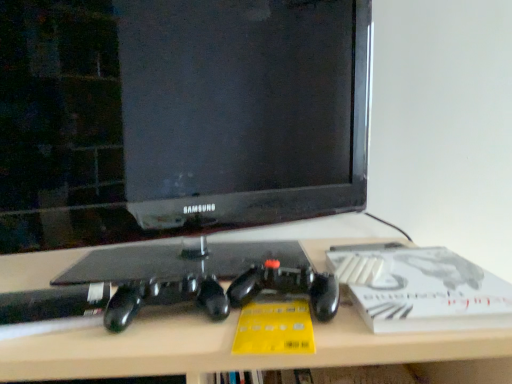
Question: From the image's perspective, relative to white matte paperback book at right, is black glossy monitor at center above or below?

Choices:
 (A) above
 (B) below

Answer: (A)

Question: Considering the positions of black glossy monitor at center and white matte paperback book at right in the image, is black glossy monitor at center wider or thinner than white matte paperback book at right?

Choices:
 (A) thin
 (B) wide

Answer: (A)

Question: Based on their relative distances, which object is farther from the white matte paperback book at right?

Choices:
 (A) matte black desk at center
 (B) black glossy monitor at center

Answer: (B)

Question: Based on their relative distances, which object is farther from the matte black desk at center?

Choices:
 (A) white matte paperback book at right
 (B) black glossy monitor at center

Answer: (B)